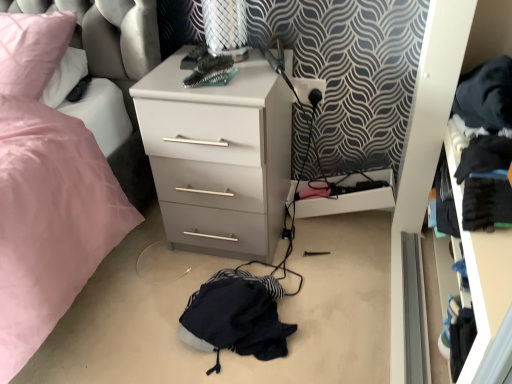
The image size is (512, 384). In order to click on vacant area that lies between white plastic drawer at lower center and dark blue fabric at center in this screenshot , I will do `click(319, 266)`.